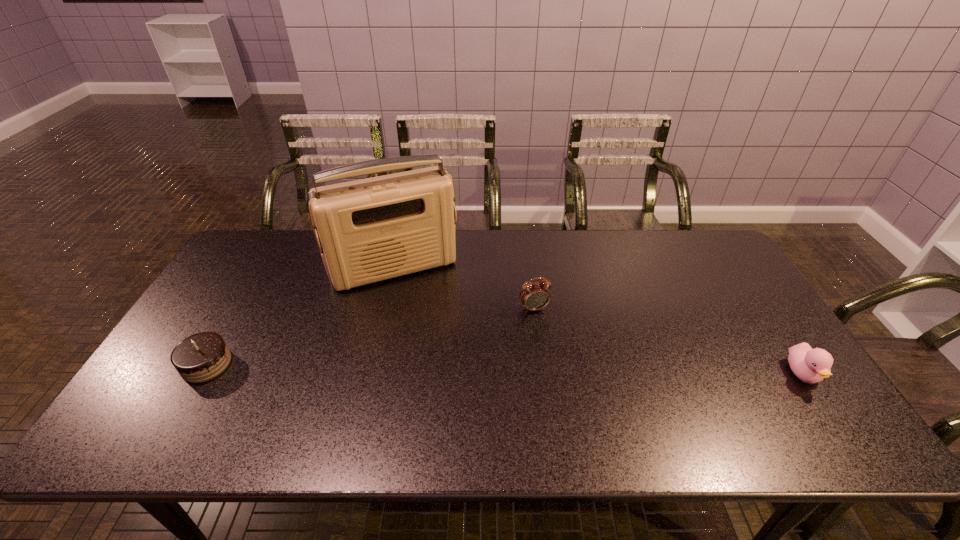
You are a GUI agent. You are given a task and a screenshot of the screen. Output one action in this format:
    pyautogui.click(x=<x>, y=<y>)
    Task: Click on the free region located 0.230m on the front-facing side of the second object from left to right
    The image size is (960, 540).
    Given the screenshot: What is the action you would take?
    pyautogui.click(x=438, y=346)

At what (x,y) coordinates should I click in order to perform the action: click on free space located 0.080m on the face of the second object from right to left. Please return your answer as a coordinate pair (x, y). This screenshot has width=960, height=540. Looking at the image, I should click on (547, 335).

This screenshot has height=540, width=960. In order to click on vacant region located on the face of the second object from right to left in this screenshot , I will do `click(572, 389)`.

Locate an element on the screen. The height and width of the screenshot is (540, 960). vacant area located 0.160m on the face of the second object from right to left is located at coordinates (558, 357).

At what (x,y) coordinates should I click in order to perform the action: click on object at the far edge. Please return your answer as a coordinate pair (x, y). Looking at the image, I should click on (369, 230).

Find the location of a particular element. This screenshot has width=960, height=540. chocolate cake that is at the near edge is located at coordinates (203, 356).

You are a GUI agent. You are given a task and a screenshot of the screen. Output one action in this format:
    pyautogui.click(x=<x>, y=<y>)
    Task: Click on the duckling located in the near edge section of the desktop
    The image size is (960, 540).
    Given the screenshot: What is the action you would take?
    pyautogui.click(x=810, y=365)

Image resolution: width=960 pixels, height=540 pixels. I want to click on object at the left edge, so click(203, 356).

I want to click on object present at the right edge, so click(x=810, y=365).

The height and width of the screenshot is (540, 960). In order to click on object located in the near left corner section of the desktop in this screenshot , I will do `click(203, 356)`.